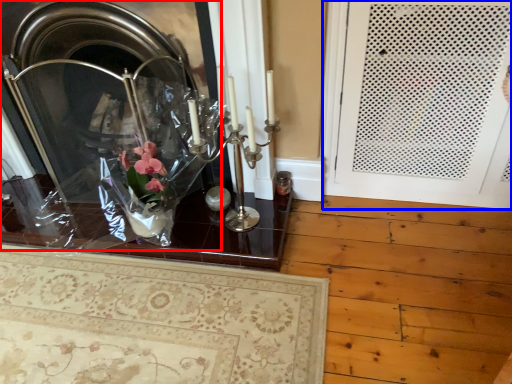
Question: Which point is closer to the camera, fireplace (highlighted by a red box) or door (highlighted by a blue box)?

Choices:
 (A) fireplace
 (B) door

Answer: (B)